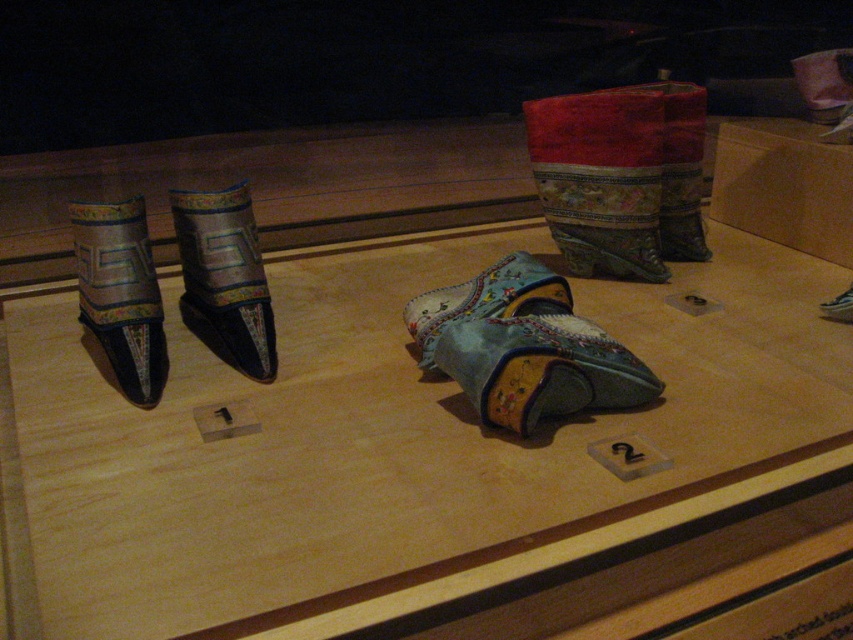
Is point (258, 456) positioned after point (190, 276)?

No, (258, 456) is closer to viewer.

Looking at this image, measure the distance between point (378,468) and camera.

Point (378,468) is 35.60 inches away from camera.

Identify the location of matte blue fabric shoes at center. Image resolution: width=853 pixels, height=640 pixels. (392, 442).

Based on the photo, who is higher up, light blue fabric shoe at center or silk embroidered boot at left?

silk embroidered boot at left

Between point (503, 403) and point (252, 220), which one is positioned in front?

Point (503, 403)

Is point (543, 324) closer to camera compared to point (259, 349)?

That is True.

Identify the location of light blue fabric shoe at center. This screenshot has height=640, width=853. (524, 348).

Can you confirm if light blue fabric shoe at center is positioned to the right of silky satin boot at left?

Yes, light blue fabric shoe at center is to the right of silky satin boot at left.

Is light blue fabric shoe at center thinner than silky satin boot at left?

Incorrect, light blue fabric shoe at center's width is not less than silky satin boot at left's.

Is point (581, 404) positioned behind point (83, 205)?

No.

Identify the location of light blue fabric shoe at center. (524, 348).